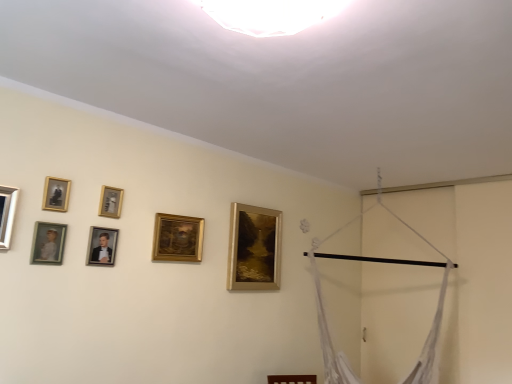
Question: Does matte gold picture frame at left, the 6th picture frame in the right-to-left sequence, turn towards gold metallic picture frame at center, which is the 6th picture frame from left to right?

Choices:
 (A) no
 (B) yes

Answer: (A)

Question: Can you see matte gold picture frame at left, the 6th picture frame in the right-to-left sequence, touching gold metallic picture frame at center, which appears as the second picture frame when viewed from the right?

Choices:
 (A) no
 (B) yes

Answer: (A)

Question: Is matte gold picture frame at left, which appears as the 2th picture frame when viewed from the front, to the right of gold metallic picture frame at center, the 6th picture frame in the front-to-back sequence, from the viewer's perspective?

Choices:
 (A) yes
 (B) no

Answer: (B)

Question: Can you confirm if matte gold picture frame at left, which is the second picture frame in left-to-right order, is smaller than gold metallic picture frame at center, which appears as the second picture frame when viewed from the right?

Choices:
 (A) no
 (B) yes

Answer: (B)

Question: Does matte gold picture frame at left, which appears as the 2th picture frame when viewed from the front, have a greater height compared to gold metallic picture frame at center, which is the 6th picture frame from left to right?

Choices:
 (A) no
 (B) yes

Answer: (A)

Question: Can you confirm if matte gold picture frame at left, the 6th picture frame in the right-to-left sequence, is bigger than gold metallic picture frame at center, the 6th picture frame in the front-to-back sequence?

Choices:
 (A) no
 (B) yes

Answer: (A)

Question: Does gold metallic picture frame at upper center, marked as the fifth picture frame in a front-to-back arrangement, have a lesser height compared to gold/golden frame at upper center, which appears as the first picture frame when viewed from the right?

Choices:
 (A) yes
 (B) no

Answer: (A)

Question: Can you confirm if gold metallic picture frame at upper center, the 3th picture frame viewed from the right, is thinner than gold/golden frame at upper center, the seventh picture frame positioned from the front?

Choices:
 (A) yes
 (B) no

Answer: (A)

Question: Considering the relative sizes of gold metallic picture frame at upper center, the 3th picture frame viewed from the right, and gold/golden frame at upper center, positioned as the 7th picture frame in left-to-right order, in the image provided, is gold metallic picture frame at upper center, the 3th picture frame viewed from the right, smaller than gold/golden frame at upper center, positioned as the 7th picture frame in left-to-right order,?

Choices:
 (A) yes
 (B) no

Answer: (A)

Question: Can you confirm if gold metallic picture frame at upper center, which is the 3th picture frame in back-to-front order, is positioned to the left of gold/golden frame at upper center, the seventh picture frame positioned from the front?

Choices:
 (A) no
 (B) yes

Answer: (B)

Question: Is gold/golden frame at upper center, which is the first picture frame in back-to-front order, completely or partially inside gold metallic picture frame at upper center, the 3th picture frame viewed from the right?

Choices:
 (A) no
 (B) yes

Answer: (A)

Question: Can you confirm if gold metallic picture frame at upper center, which is the 3th picture frame in back-to-front order, is positioned to the right of gold/golden frame at upper center, the seventh picture frame positioned from the front?

Choices:
 (A) yes
 (B) no

Answer: (B)

Question: From the image's perspective, is matte gold picture frame at left, which is the second picture frame in left-to-right order, over matte silver picture frame at left, acting as the first picture frame starting from the left?

Choices:
 (A) no
 (B) yes

Answer: (A)